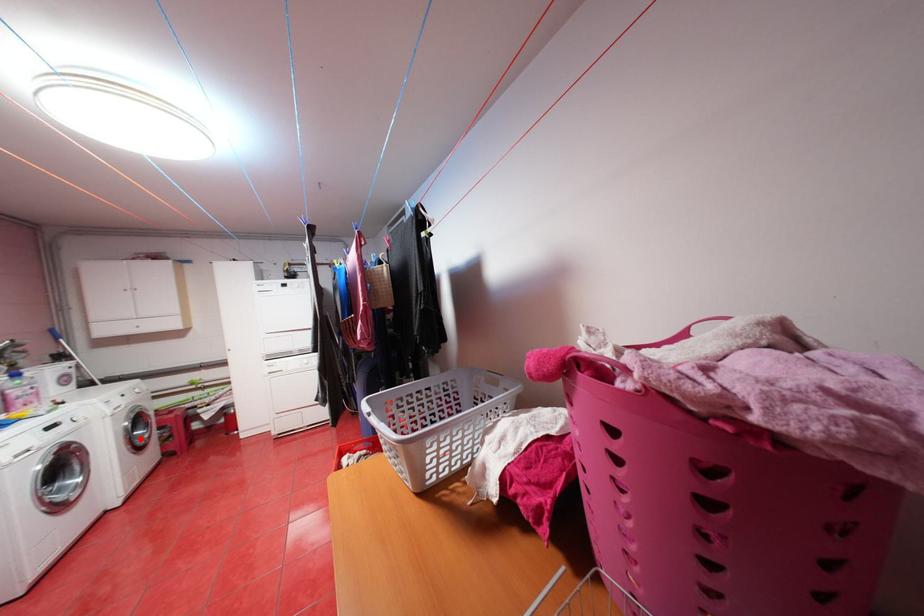
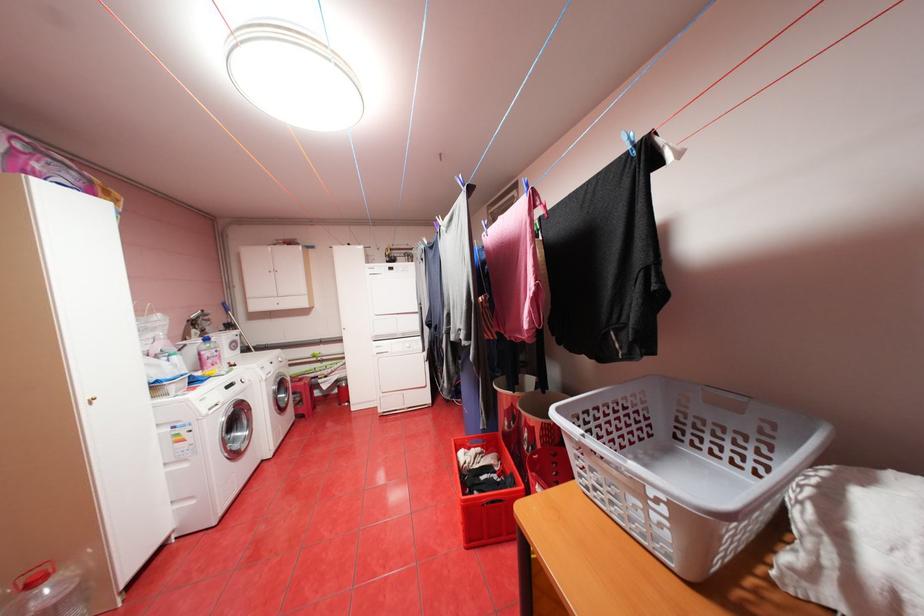
Question: I am providing you with two images of the same scene from different viewpoints. In image1, a red point is highlighted. Considering the same 3D point in image2, which of the following is correct?

Choices:
 (A) It is closer
 (B) It is farther

Answer: (A)